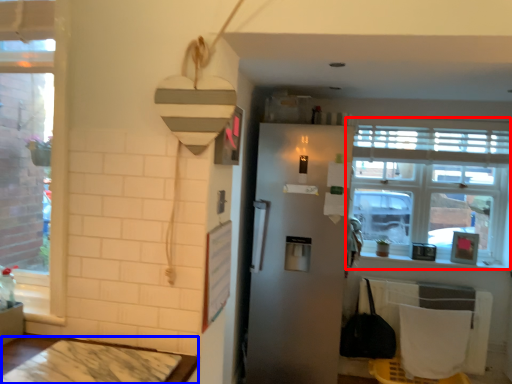
Question: Which object is closer to the camera taking this photo, window (highlighted by a red box) or table (highlighted by a blue box)?

Choices:
 (A) window
 (B) table

Answer: (B)